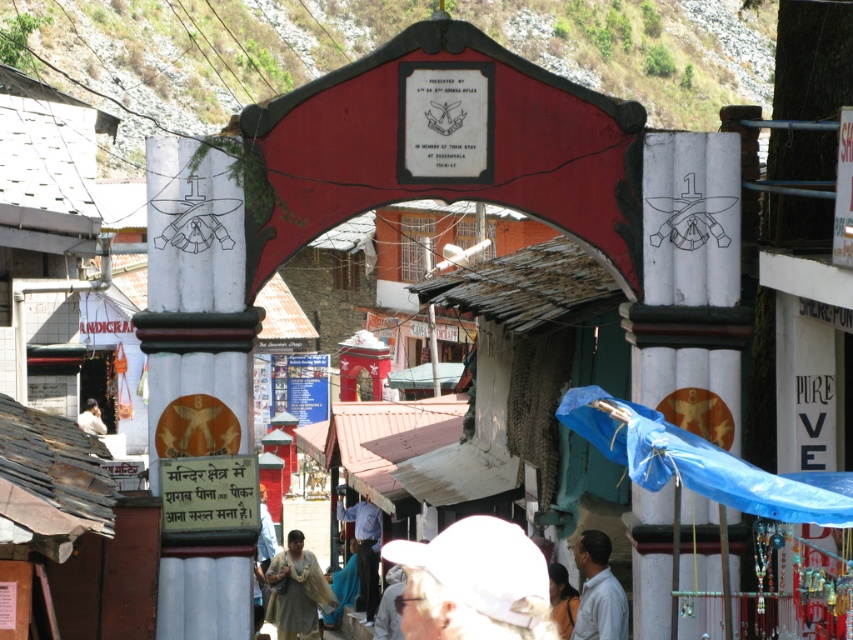
Looking at this image, can you confirm if white painted stone column at center is positioned above light beige fabric at lower left?

Yes.

Which of these two, white painted stone column at center or light beige fabric at lower left, stands shorter?

light beige fabric at lower left is shorter.

Find the location of a particular element. white painted stone column at center is located at coordinates (691, 220).

Does white fabric cap at center come behind light beige fabric at lower left?

No, white fabric cap at center is closer to the viewer.

Does white fabric cap at center have a larger size compared to light beige fabric at lower left?

Correct, white fabric cap at center is larger in size than light beige fabric at lower left.

Which is in front, point (543, 625) or point (85, 417)?

Point (543, 625) is in front.

This screenshot has height=640, width=853. Find the location of `white fabric cap at center`. white fabric cap at center is located at coordinates (474, 582).

Can you confirm if white painted stone column at center is smaller than blue shirt at center?

Incorrect, white painted stone column at center is not smaller in size than blue shirt at center.

Can you confirm if white painted stone column at center is bigger than blue shirt at center?

Correct, white painted stone column at center is larger in size than blue shirt at center.

Consider the image. Who is more distant from viewer, (x=651, y=198) or (x=368, y=522)?

Positioned behind is point (x=368, y=522).

The image size is (853, 640). I want to click on white painted stone column at center, so click(x=691, y=220).